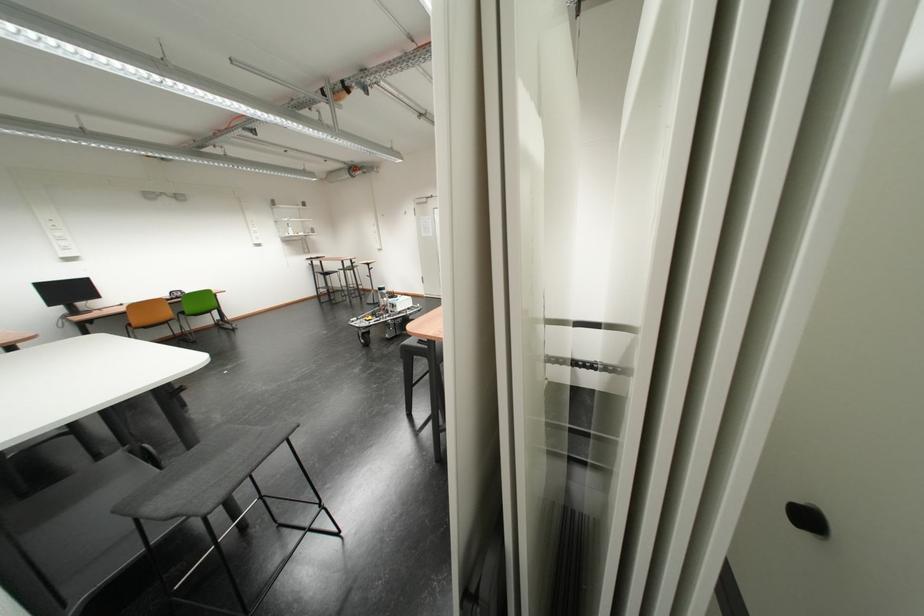
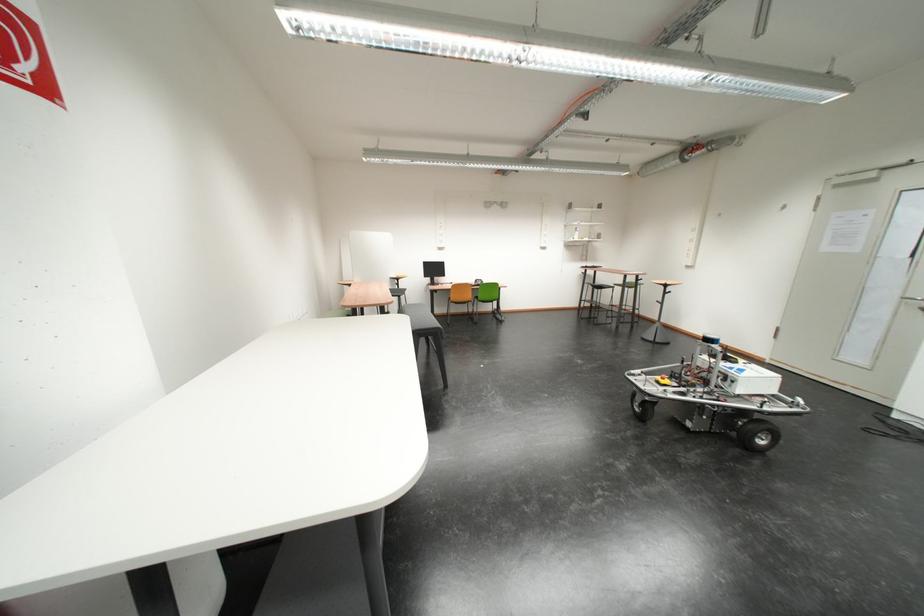
Find the pixel in the second image that matches pixel 338 276 in the first image.

(612, 290)